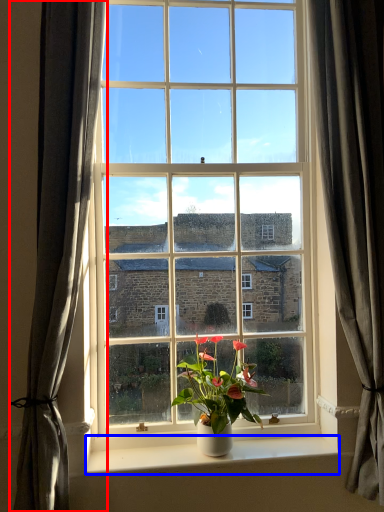
Question: Which of the following is the closest to the observer, curtain (highlighted by a red box) or window sill (highlighted by a blue box)?

Choices:
 (A) curtain
 (B) window sill

Answer: (A)